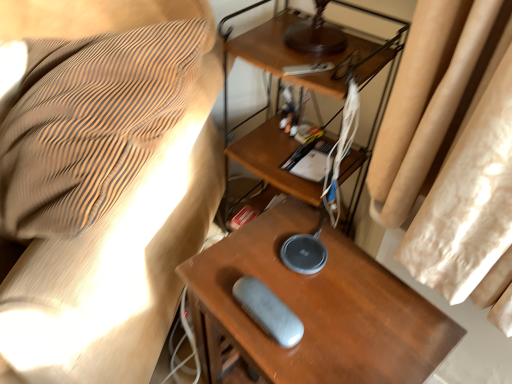
What do you see at coordinates (268, 311) in the screenshot? I see `gray matte speaker at center` at bounding box center [268, 311].

The width and height of the screenshot is (512, 384). What do you see at coordinates (318, 308) in the screenshot? I see `wooden table at center` at bounding box center [318, 308].

Where is `woodendesk at center`? The width and height of the screenshot is (512, 384). woodendesk at center is located at coordinates (307, 54).

Image resolution: width=512 pixels, height=384 pixels. Identify the location of gray matte speaker at center. (268, 311).

Considering the relative positions of wooden table at center and gray fabric pouch at lower center in the image provided, is wooden table at center behind gray fabric pouch at lower center?

Yes, it is.

Between wooden table at center and gray fabric pouch at lower center, which one has less height?

With less height is gray fabric pouch at lower center.

From the image's perspective, is wooden table at center located beneath gray fabric pouch at lower center?

Yes.

Consider the image. How many degrees apart are the facing directions of wooden table at center and gray fabric pouch at lower center?

They differ by 22.4 degrees in their facing directions.

How distant is gray matte speaker at center from wooden table at center?

The distance of gray matte speaker at center from wooden table at center is 13.23 centimeters.

From the image's perspective, which one is positioned higher, gray matte speaker at center or wooden table at center?

gray matte speaker at center, from the image's perspective.

You are a GUI agent. You are given a task and a screenshot of the screen. Output one action in this format:
    pyautogui.click(x=<x>, y=<y>)
    Task: Click on the table in front of the gray matte speaker at center
    
    Given the screenshot: What is the action you would take?
    pyautogui.click(x=318, y=308)

Can you see gray matte speaker at center touching wooden table at center?

No, gray matte speaker at center is not in contact with wooden table at center.

Can you confirm if woodendesk at center is thinner than gray matte speaker at center?

In fact, woodendesk at center might be wider than gray matte speaker at center.

Is woodendesk at center not inside gray matte speaker at center?

Yes, woodendesk at center is outside of gray matte speaker at center.

Between woodendesk at center and gray matte speaker at center, which one has more height?

woodendesk at center is taller.

Does gray fabric pouch at lower center appear on the right side of gray matte speaker at center?

No, gray fabric pouch at lower center is not to the right of gray matte speaker at center.

From a real-world perspective, does gray fabric pouch at lower center sit lower than gray matte speaker at center?

Incorrect, from a real-world perspective, gray fabric pouch at lower center is higher than gray matte speaker at center.

Does point (10, 325) come closer to viewer compared to point (256, 291)?

Yes.

Based on the photo, can we say gray fabric pouch at lower center lies outside woodendesk at center?

Yes, gray fabric pouch at lower center is located beyond the bounds of woodendesk at center.

From the image's perspective, is gray fabric pouch at lower center below woodendesk at center?

No.

Who is smaller, gray fabric pouch at lower center or woodendesk at center?

With smaller size is woodendesk at center.

From the image's perspective, does gray fabric pouch at lower center appear lower than wooden table at center?

No, from the image's perspective, gray fabric pouch at lower center is not below wooden table at center.

Is point (49, 379) closer to viewer compared to point (265, 368)?

That is False.

How many degrees apart are the facing directions of gray fabric pouch at lower center and wooden table at center?

The angular difference between gray fabric pouch at lower center and wooden table at center is 22.4 degrees.

Where is `furniture that is above the wooden table at center (from a real-world perspective)`? furniture that is above the wooden table at center (from a real-world perspective) is located at coordinates (116, 224).

Find the location of a particular element. table below the woodendesk at center (from the image's perspective) is located at coordinates (318, 308).

From a real-world perspective, between wooden table at center and woodendesk at center, who is vertically lower?

wooden table at center, from a real-world perspective.

Considering the positions of objects wooden table at center and woodendesk at center in the image provided, who is more to the left, wooden table at center or woodendesk at center?

wooden table at center is more to the left.

Where is `furniture lying on the left of wooden table at center`? The image size is (512, 384). furniture lying on the left of wooden table at center is located at coordinates (116, 224).

You are a GUI agent. You are given a task and a screenshot of the screen. Output one action in this format:
    pyautogui.click(x=<x>, y=<y>)
    Task: Click on the table that appears on the right of gray matte speaker at center
    Image resolution: width=512 pixels, height=384 pixels.
    Given the screenshot: What is the action you would take?
    pyautogui.click(x=318, y=308)

Considering their positions, is gray fabric pouch at lower center positioned further to gray matte speaker at center than woodendesk at center?

woodendesk at center lies further to gray matte speaker at center than the other object.

From the picture: From the image, which object appears to be nearer to gray matte speaker at center, wooden table at center or woodendesk at center?

The object closer to gray matte speaker at center is wooden table at center.

Based on their spatial positions, is gray matte speaker at center or gray fabric pouch at lower center further from wooden table at center?

gray fabric pouch at lower center lies further to wooden table at center than the other object.

Estimate the real-world distances between objects in this image. Which object is closer to gray fabric pouch at lower center, wooden table at center or woodendesk at center?

wooden table at center.

When comparing their distances from gray fabric pouch at lower center, does gray matte speaker at center or wooden table at center seem closer?

Based on the image, wooden table at center appears to be nearer to gray fabric pouch at lower center.

Consider the image. Based on their spatial positions, is gray matte speaker at center or wooden table at center further from woodendesk at center?

gray matte speaker at center is positioned further to the anchor woodendesk at center.

Considering their positions, is wooden table at center positioned closer to woodendesk at center than gray matte speaker at center?

The object closer to woodendesk at center is wooden table at center.

From the image, which object appears to be farther from gray fabric pouch at lower center, wooden table at center or gray matte speaker at center?

Among the two, gray matte speaker at center is located further to gray fabric pouch at lower center.

Where is `equipment between woodendesk at center and wooden table at center from top to bottom`? equipment between woodendesk at center and wooden table at center from top to bottom is located at coordinates (268, 311).

Where is `equipment between gray fabric pouch at lower center and wooden table at center in the up-down direction`? Image resolution: width=512 pixels, height=384 pixels. equipment between gray fabric pouch at lower center and wooden table at center in the up-down direction is located at coordinates (268, 311).

Locate an element on the screen. The height and width of the screenshot is (384, 512). computer desk between gray fabric pouch at lower center and wooden table at center in the vertical direction is located at coordinates (307, 54).

Where is `equipment situated between gray fabric pouch at lower center and woodendesk at center from left to right`? Image resolution: width=512 pixels, height=384 pixels. equipment situated between gray fabric pouch at lower center and woodendesk at center from left to right is located at coordinates pos(268,311).